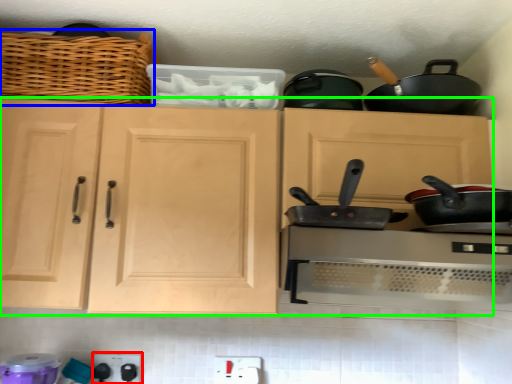
Question: Which object is positioned closest to appliance (highlighted by a red box)? Select from basket (highlighted by a blue box) and cabinetry (highlighted by a green box).

Choices:
 (A) basket
 (B) cabinetry

Answer: (B)